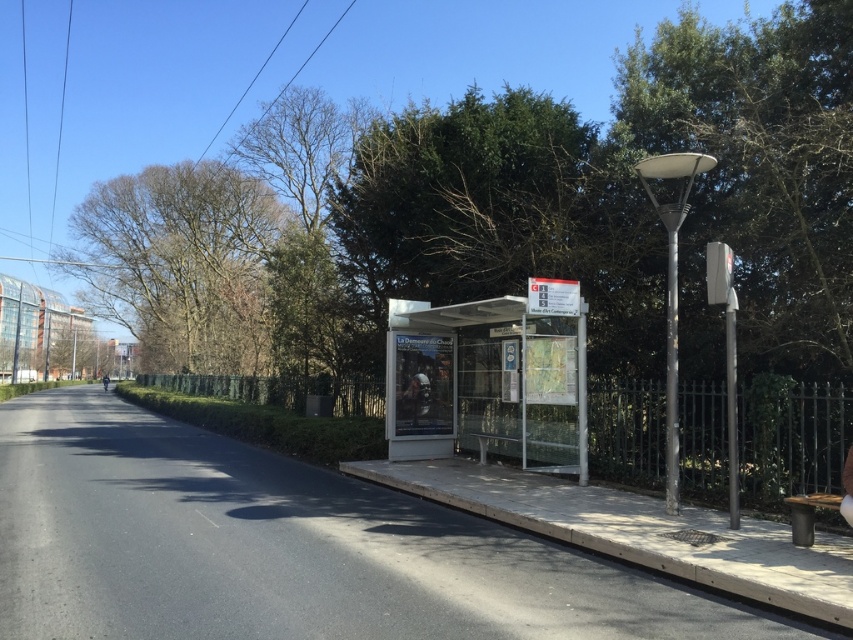
Between bare branches at upper left and metallic silver bus stop at center, which one has more height?

With more height is bare branches at upper left.

Is bare branches at upper left below metallic silver bus stop at center?

No, bare branches at upper left is not below metallic silver bus stop at center.

Between point (173, 186) and point (421, 420), which one is positioned in front?

Point (421, 420) is more forward.

The height and width of the screenshot is (640, 853). I want to click on bare branches at upper left, so click(183, 262).

Can you confirm if metallic silver bus stop at center is smaller than dark brown wooden bench at lower right?

No.

Does metallic silver bus stop at center appear under dark brown wooden bench at lower right?

No, metallic silver bus stop at center is not below dark brown wooden bench at lower right.

Which is behind, point (518, 348) or point (793, 499)?

Positioned behind is point (518, 348).

This screenshot has height=640, width=853. In order to click on metallic silver bus stop at center in this screenshot , I will do `click(490, 378)`.

Can you confirm if concrete pavement at center is positioned to the right of metallic silver bus stop at center?

Incorrect, concrete pavement at center is not on the right side of metallic silver bus stop at center.

Does concrete pavement at center have a larger size compared to metallic silver bus stop at center?

Yes.

Locate an element on the screen. Image resolution: width=853 pixels, height=640 pixels. concrete pavement at center is located at coordinates (286, 548).

Where is `concrete pavement at center`? concrete pavement at center is located at coordinates (286, 548).